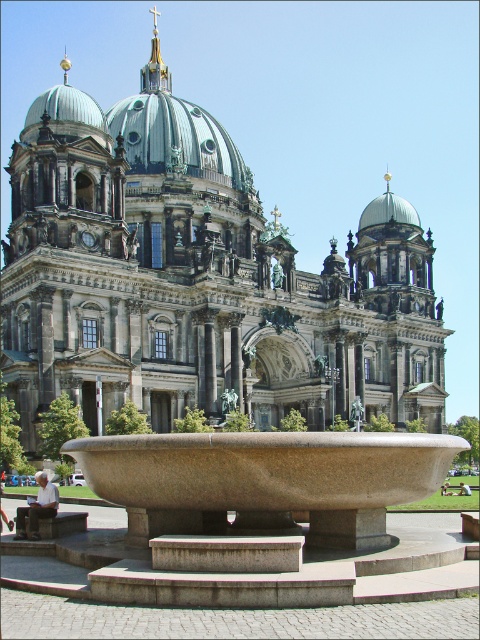
You are standing in front of the cathedral complex and want to take a photo of the dark gray stone church at center. If your camera can focus on objects up to 70 meters away, will it be able to capture the church clearly?

The dark gray stone church at center is 67.41 meters from the camera, which is within the camera focus range of up to 70 meters. Therefore, the camera can capture the church clearly.

You are standing at the point marked by coordinates point (195, 280) in the image. Based on the scene described, what structure are you directly facing?

The point (195, 280) indicates dark gray stone church at center, so you are directly facing the dark gray stone church at center.

In the scene shown: You are standing in front of the cathedral and want to take a photo of both the brown stone fountain at center and the green copper dome at center. Which object should you focus on first to ensure both are in the frame?

You should focus on the brown stone fountain at center first because it is closer to you than the green copper dome at center, so adjusting the camera to include both would require starting with the closer object.